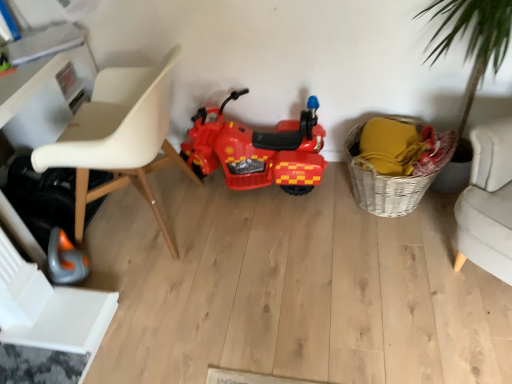
Locate an element on the screen. Image resolution: width=512 pixels, height=384 pixels. vacant area in front of shiny plastic motorcycle at center is located at coordinates [272, 243].